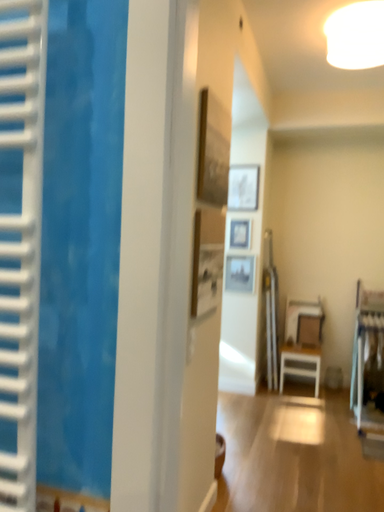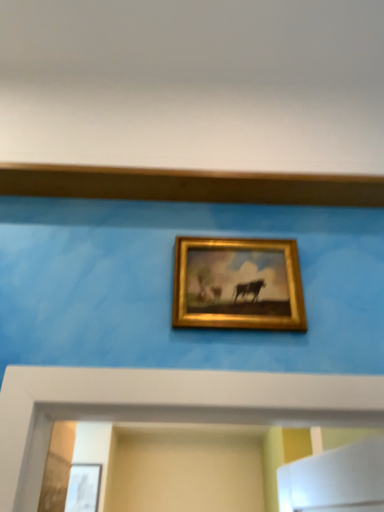
Question: Which way did the camera rotate in the video?

Choices:
 (A) rotated upward
 (B) rotated downward

Answer: (A)